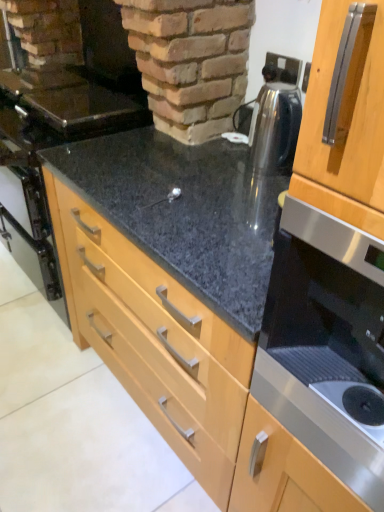
Describe the element at coordinates (326, 344) in the screenshot. I see `black glass oven at right` at that location.

Locate an element on the screen. black glass oven at right is located at coordinates (326, 344).

What is the approximate width of black glass oven at right?

16.93 inches.

I want to click on black glass oven at right, so click(326, 344).